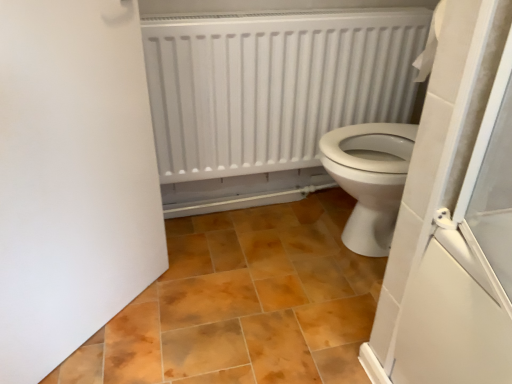
Find the location of a particular element. This screenshot has width=512, height=384. empty space that is to the right of white matte door at left is located at coordinates (201, 320).